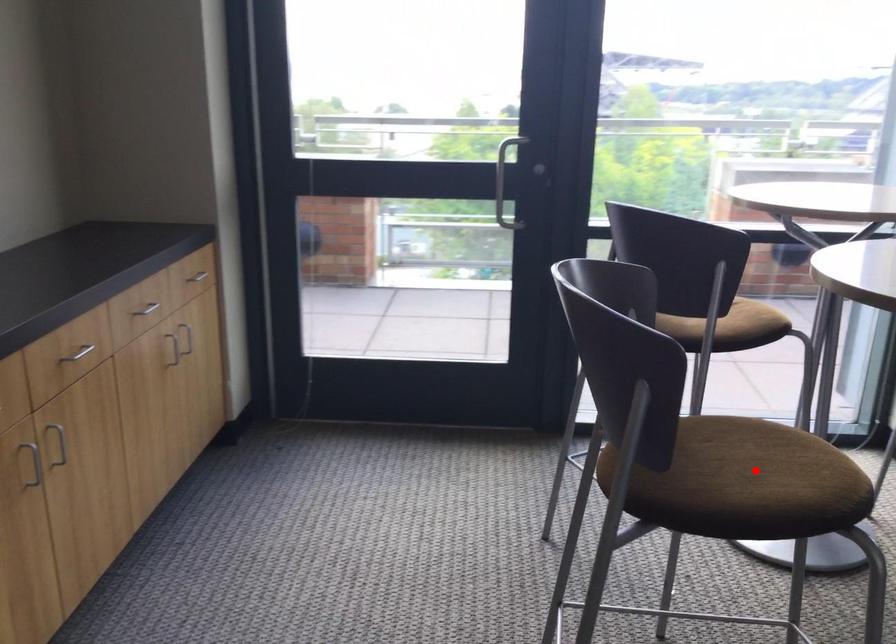
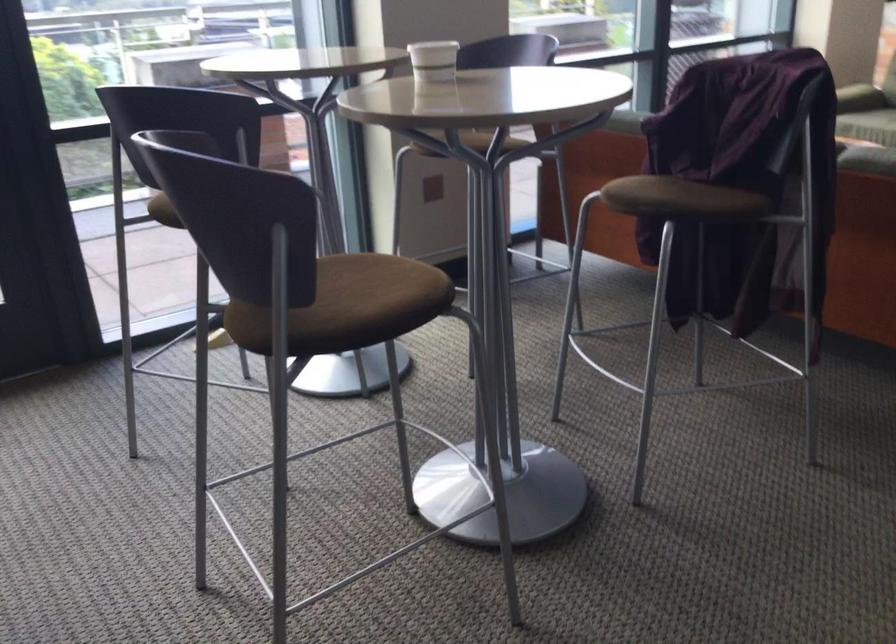
Where in the second image is the point corresponding to the highlighted location from the first image?

(371, 292)